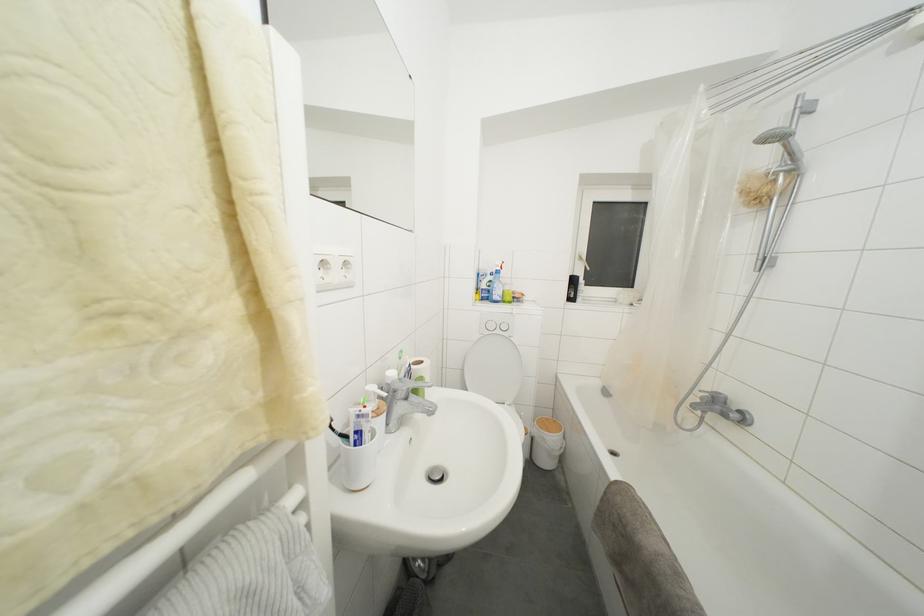
The image size is (924, 616). Describe the element at coordinates (493, 368) in the screenshot. I see `the white toilet lid` at that location.